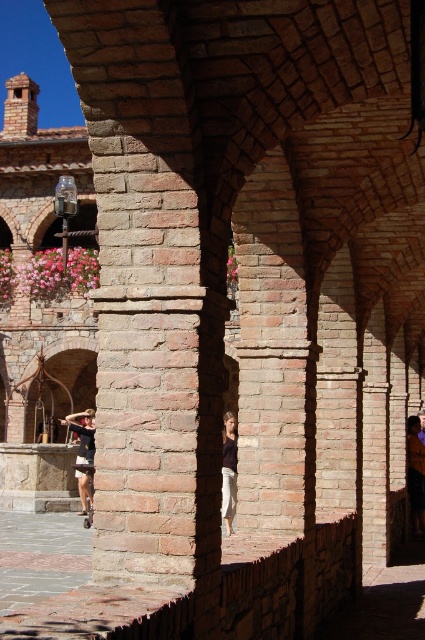
You are standing in a historic courtyard and notice a brick archway at center and dark blue jeans at center. Which object is closer to you?

The brick archway at center is closer to you than the dark blue jeans at center.

You are standing in the historic stone structure and notice two items on the ground. The dark blue jeans at center and the dark brown leather jacket at lower left. Which item is shorter in height?

The dark blue jeans at center is shorter in height compared to the dark brown leather jacket at lower left according to the description.